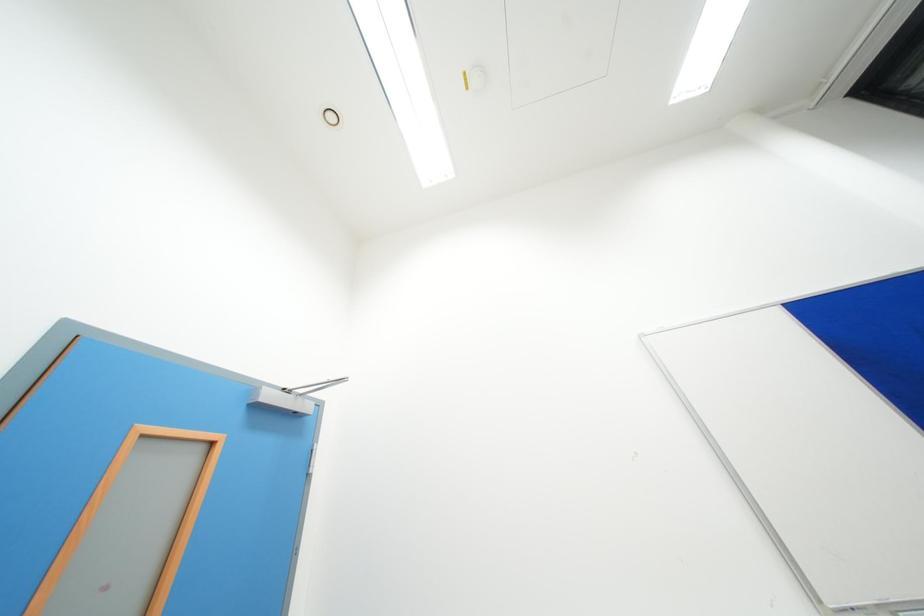
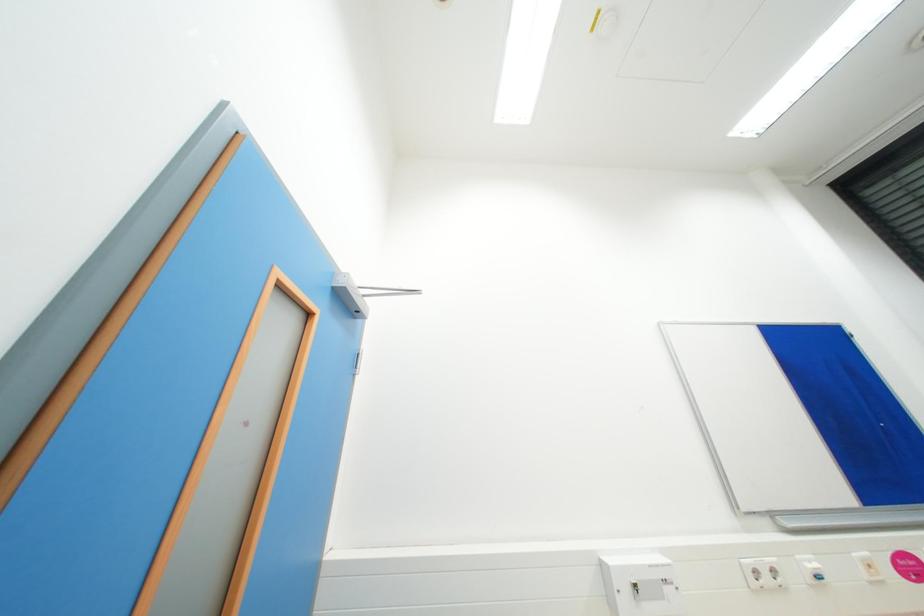
Question: The camera is either moving clockwise (left) or counter-clockwise (right) around the object. The first image is from the beginning of the video and the second image is from the end. Is the camera moving left or right when shooting the video?

Choices:
 (A) Left
 (B) Right

Answer: (A)